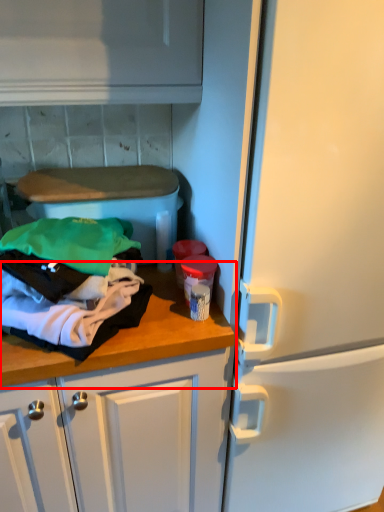
Question: From the image's perspective, considering the relative positions of countertop (annotated by the red box) and clothing in the image provided, where is countertop (annotated by the red box) located with respect to the staircase?

Choices:
 (A) below
 (B) above

Answer: (A)